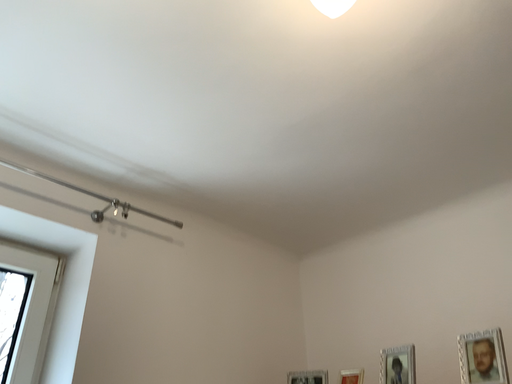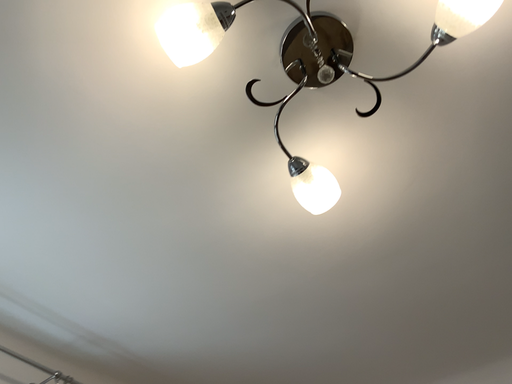
Question: Which way did the camera rotate in the video?

Choices:
 (A) rotated right
 (B) rotated left

Answer: (A)